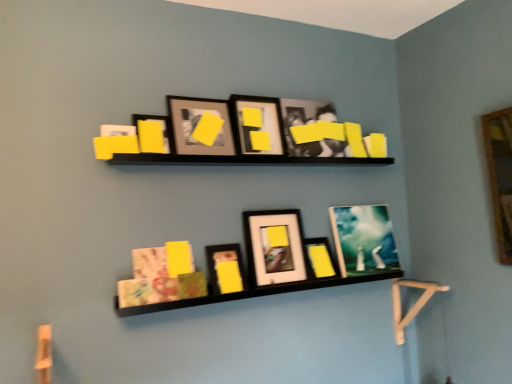
This screenshot has width=512, height=384. What do you see at coordinates (364, 240) in the screenshot?
I see `matte glass picture frame at upper center, which is the first picture frame from right to left` at bounding box center [364, 240].

What do you see at coordinates (201, 126) in the screenshot?
I see `matte black picture frame at upper center, which is the seventh picture frame from right to left` at bounding box center [201, 126].

Describe the element at coordinates (225, 268) in the screenshot. I see `matte black picture frame at center, the third picture frame in the left-to-right sequence` at that location.

What is the approximate width of matte black picture frame at center, which is the 6th picture frame from right to left?

matte black picture frame at center, which is the 6th picture frame from right to left, is 3.46 inches wide.

This screenshot has height=384, width=512. What do you see at coordinates (310, 123) in the screenshot?
I see `matte black picture frame at upper center, the 6th picture frame viewed from the left` at bounding box center [310, 123].

The height and width of the screenshot is (384, 512). In order to click on matte glass picture frame at upper center, which is the first picture frame from right to left in this screenshot , I will do `click(364, 240)`.

Can you see black matte shelf at center touching matte black picture frame at center, the second picture frame from the right?

No, black matte shelf at center is not making contact with matte black picture frame at center, the second picture frame from the right.

Does point (267, 244) lie in front of point (337, 272)?

Yes, it is in front of point (337, 272).

Is black matte shelf at center located outside matte black picture frame at center, the second picture frame from the right?

Yes, black matte shelf at center is not within matte black picture frame at center, the second picture frame from the right.

Which of these two, black matte shelf at center or matte black picture frame at center, the second picture frame from the right, is thinner?

With smaller width is matte black picture frame at center, the second picture frame from the right.

Between point (281, 280) and point (132, 256), which one is positioned in front?

The point (132, 256) is closer.

Is matte paper book at lower center at the back of matte black picture frame at center, acting as the 5th picture frame starting from the left?

No, matte black picture frame at center, acting as the 5th picture frame starting from the left, is not facing the opposite direction of matte paper book at lower center.

Can you see matte black picture frame at center, acting as the 5th picture frame starting from the left, touching matte paper book at lower center?

No, matte black picture frame at center, acting as the 5th picture frame starting from the left, is not beside matte paper book at lower center.

Does matte black picture frame at center, acting as the 5th picture frame starting from the left, appear on the right side of matte paper book at lower center?

Indeed, matte black picture frame at center, acting as the 5th picture frame starting from the left, is positioned on the right side of matte paper book at lower center.

How many degrees apart are the facing directions of matte black picture frame at upper center, which appears as the second picture frame when viewed from the left, and matte glass picture frame at upper center, acting as the 8th picture frame starting from the left?

The facing directions of matte black picture frame at upper center, which appears as the second picture frame when viewed from the left, and matte glass picture frame at upper center, acting as the 8th picture frame starting from the left, are 0.00244 degrees apart.

Is matte black picture frame at upper center, which is the seventh picture frame from right to left, facing towards matte glass picture frame at upper center, acting as the 8th picture frame starting from the left?

No.

Looking at this image, is the depth of matte black picture frame at upper center, which is the seventh picture frame from right to left, less than that of matte glass picture frame at upper center, which is the first picture frame from right to left?

Yes, it is in front of matte glass picture frame at upper center, which is the first picture frame from right to left.

From a real-world perspective, who is located lower, matte black picture frame at upper center, which is the seventh picture frame from right to left, or matte glass picture frame at upper center, acting as the 8th picture frame starting from the left?

matte glass picture frame at upper center, acting as the 8th picture frame starting from the left, is physically lower.

Which is in front, matte paper book at lower center or black matte shelf at center?

black matte shelf at center is in front.

From the image's perspective, which object appears higher, matte paper book at lower center or black matte shelf at center?

black matte shelf at center, from the image's perspective.

Consider the image. Considering the sizes of objects matte paper book at lower center and black matte shelf at center in the image provided, who is bigger, matte paper book at lower center or black matte shelf at center?

black matte shelf at center.

Based on the photo, is matte paper book at lower center facing towards black matte shelf at center?

Yes, matte paper book at lower center is turned towards black matte shelf at center.

Is matte black picture frame at center, the second picture frame from the right, looking in the opposite direction of black matte shelf at center?

Yes, black matte shelf at center is at the back of matte black picture frame at center, the second picture frame from the right.

From the image's perspective, is matte black picture frame at center, the second picture frame from the right, on black matte shelf at center?

Actually, matte black picture frame at center, the second picture frame from the right, appears below black matte shelf at center in the image.

From a real-world perspective, which is physically above, matte black picture frame at center, the seventh picture frame positioned from the left, or black matte shelf at center?

From a 3D spatial view, black matte shelf at center is above.

Is matte black picture frame at center, the second picture frame from the right, next to black matte shelf at center?

matte black picture frame at center, the second picture frame from the right, and black matte shelf at center are not in contact.

Considering the positions of objects matte black picture frame at upper center, the first picture frame when ordered from left to right, and matte black picture frame at upper center, which is the seventh picture frame from right to left, in the image provided, who is in front, matte black picture frame at upper center, the first picture frame when ordered from left to right, or matte black picture frame at upper center, which is the seventh picture frame from right to left,?

matte black picture frame at upper center, the first picture frame when ordered from left to right, is closer to the camera.

Looking at this image, in terms of size, does matte black picture frame at upper center, acting as the eighth picture frame starting from the right, appear bigger or smaller than matte black picture frame at upper center, which appears as the second picture frame when viewed from the left?

matte black picture frame at upper center, acting as the eighth picture frame starting from the right, is smaller than matte black picture frame at upper center, which appears as the second picture frame when viewed from the left.

Is matte black picture frame at upper center, acting as the eighth picture frame starting from the right, located outside matte black picture frame at upper center, which appears as the second picture frame when viewed from the left?

Yes.

Which of these two, matte black picture frame at upper center, the first picture frame when ordered from left to right, or matte black picture frame at upper center, which appears as the second picture frame when viewed from the left, is wider?

Wider between the two is matte black picture frame at upper center, which appears as the second picture frame when viewed from the left.

Is matte paper book at lower center touching matte black picture frame at upper center, the first picture frame when ordered from left to right?

No, matte paper book at lower center is not beside matte black picture frame at upper center, the first picture frame when ordered from left to right.

Is matte paper book at lower center outside of matte black picture frame at upper center, acting as the eighth picture frame starting from the right?

Indeed, matte paper book at lower center is completely outside matte black picture frame at upper center, acting as the eighth picture frame starting from the right.

Can you confirm if matte paper book at lower center is wider than matte black picture frame at upper center, acting as the eighth picture frame starting from the right?

Indeed, matte paper book at lower center has a greater width compared to matte black picture frame at upper center, acting as the eighth picture frame starting from the right.

From the image's perspective, starting from the black matte shelf at center, which picture frame is the 3rd one below? Please provide its 2D coordinates.

[(320, 258)]

You are a GUI agent. You are given a task and a screenshot of the screen. Output one action in this format:
    pyautogui.click(x=<x>, y=<y>)
    Task: Click on the 4th picture frame counting from the right side of the matte paper book at lower center
    The height and width of the screenshot is (384, 512).
    Given the screenshot: What is the action you would take?
    pyautogui.click(x=274, y=247)

Which object lies further to the anchor point matte black picture frame at center, the second picture frame from the right, matte black picture frame at center, the third picture frame in the left-to-right sequence, or matte black picture frame at upper center, the 3th picture frame when ordered from right to left?

The object further to matte black picture frame at center, the second picture frame from the right, is matte black picture frame at upper center, the 3th picture frame when ordered from right to left.

Which object lies further to the anchor point matte black picture frame at center, the 4th picture frame positioned from the right, matte black picture frame at upper center, the 6th picture frame viewed from the left, or black matte shelf at center?

Among the two, matte black picture frame at upper center, the 6th picture frame viewed from the left, is located further to matte black picture frame at center, the 4th picture frame positioned from the right.

From the picture: When comparing their distances from black matte shelf at center, does matte black picture frame at center, acting as the 5th picture frame starting from the left, or matte black picture frame at center, the seventh picture frame positioned from the left, seem closer?

The object closer to black matte shelf at center is matte black picture frame at center, acting as the 5th picture frame starting from the left.

Based on their spatial positions, is matte black picture frame at upper center, the 6th picture frame viewed from the left, or matte black picture frame at center, which is the 6th picture frame from right to left, closer to matte black picture frame at upper center, which is the seventh picture frame from right to left?

Based on the image, matte black picture frame at upper center, the 6th picture frame viewed from the left, appears to be nearer to matte black picture frame at upper center, which is the seventh picture frame from right to left.

When comparing their distances from matte black picture frame at center, which is the 6th picture frame from right to left, does matte black picture frame at center, the second picture frame from the right, or matte paper book at lower center seem further?

matte black picture frame at center, the second picture frame from the right, lies further to matte black picture frame at center, which is the 6th picture frame from right to left, than the other object.

When comparing their distances from matte black picture frame at center, which is the 6th picture frame from right to left, does matte black picture frame at center, acting as the 5th picture frame starting from the left, or matte black picture frame at upper center, the first picture frame when ordered from left to right, seem closer?

The object closer to matte black picture frame at center, which is the 6th picture frame from right to left, is matte black picture frame at center, acting as the 5th picture frame starting from the left.

Based on their spatial positions, is matte black picture frame at center, the 4th picture frame positioned from the right, or black matte shelf at center closer to matte paper book at lower center?

black matte shelf at center.

From the image, which object appears to be farther from matte paper book at lower center, black matte shelf at center or matte black picture frame at center, the second picture frame from the right?

matte black picture frame at center, the second picture frame from the right, is further to matte paper book at lower center.

The height and width of the screenshot is (384, 512). I want to click on shelf between matte black picture frame at upper center, acting as the eighth picture frame starting from the right, and matte black picture frame at center, the seventh picture frame positioned from the left, so pos(300,255).

You are a GUI agent. You are given a task and a screenshot of the screen. Output one action in this format:
    pyautogui.click(x=<x>, y=<y>)
    Task: Click on the shelf between matte black picture frame at upper center, acting as the eighth picture frame starting from the right, and matte black picture frame at center, acting as the 5th picture frame starting from the left, in the horizontal direction
    The width and height of the screenshot is (512, 384).
    Given the screenshot: What is the action you would take?
    pyautogui.click(x=300, y=255)

This screenshot has height=384, width=512. What are the coordinates of `shelf between matte black picture frame at upper center, the 5th picture frame from the right, and matte black picture frame at center, which is the 6th picture frame from right to left, in the vertical direction` in the screenshot? It's located at (300, 255).

The image size is (512, 384). Find the location of `shelf between matte paper book at lower center and matte black picture frame at center, acting as the 5th picture frame starting from the left, in the horizontal direction`. shelf between matte paper book at lower center and matte black picture frame at center, acting as the 5th picture frame starting from the left, in the horizontal direction is located at coordinates (300, 255).